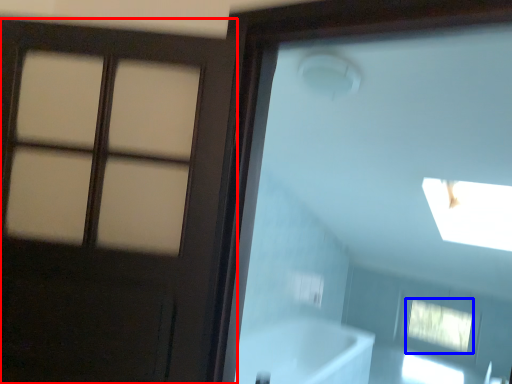
Question: Among these objects, which one is nearest to the camera, door (highlighted by a red box) or window (highlighted by a blue box)?

Choices:
 (A) door
 (B) window

Answer: (A)